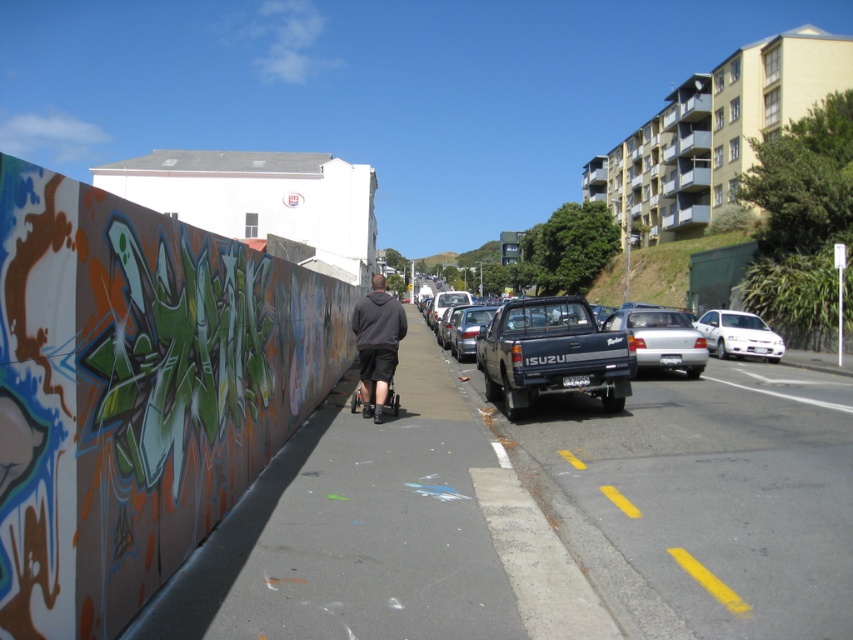
Question: Based on their relative distances, which object is nearer to the matte black pickup truck at center?

Choices:
 (A) white glossy sedan at center-right
 (B) silver metallic sedan at center-right
 (C) dark gray hoodie at center

Answer: (B)

Question: Does matte black pickup truck at center come behind silver metallic sedan at center-right?

Choices:
 (A) no
 (B) yes

Answer: (A)

Question: Among these points, which one is farthest from the camera?

Choices:
 (A) [666, 336]
 (B) [363, 433]
 (C) [601, 344]

Answer: (A)

Question: Does silver metallic sedan at center-right have a smaller size compared to white glossy sedan at center-right?

Choices:
 (A) no
 (B) yes

Answer: (A)

Question: Considering the real-world distances, which object is farthest from the dark blue matte truck at center-right?

Choices:
 (A) silver metallic sedan at center-right
 (B) matte black pickup truck at center

Answer: (A)

Question: Does matte black pickup truck at center appear on the right side of dark blue matte truck at center-right?

Choices:
 (A) yes
 (B) no

Answer: (A)